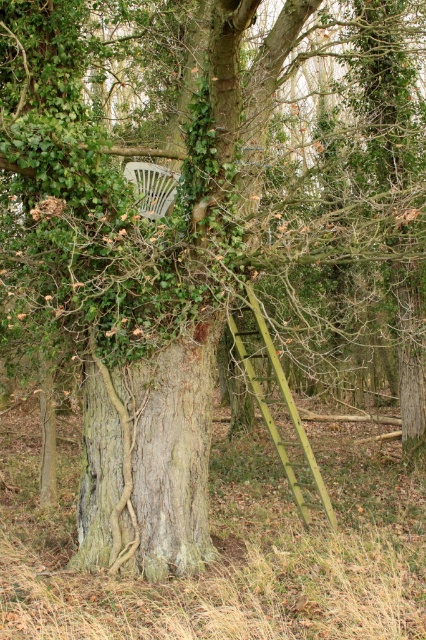
In the scene shown: You are standing in front of the large tree trunk and looking at the two points marked on the image. Which point, point (x=144, y=525) or point (x=135, y=184), is closer to you?

Point (x=144, y=525) is closer to the camera than point (x=135, y=184), so it is closer to you.

Based on the photo, you are standing in the outdoor scene described. You see a point marked at coordinates [149,460]. Which object does this point correspond to?

The point at coordinates [149,460] corresponds to the smooth bark tree trunk at center.

Based on the photo, you are standing in front of the tree and want to sit on the white plastic chair at center. Can you see the smooth bark tree trunk at center from your seated position?

Yes, because the smooth bark tree trunk at center is closer to the viewer than the white plastic chair at center, so when sitting on the chair, the tree trunk would still be visible in front of you.